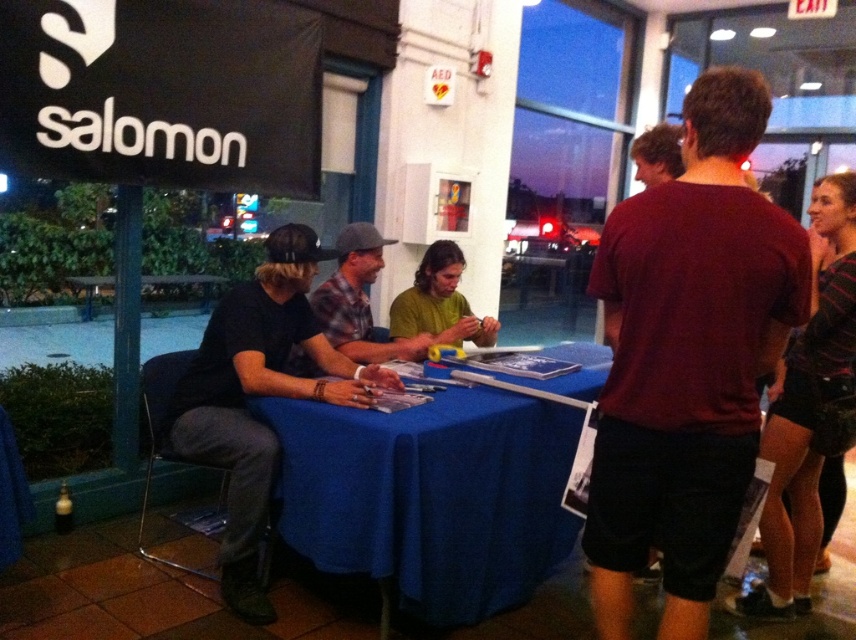
Is black cotton shirt at center closer to camera compared to green matte shirt at center?

Yes, it is.

Image resolution: width=856 pixels, height=640 pixels. I want to click on black cotton shirt at center, so click(x=259, y=396).

Which is more to the right, black cotton shirt at center or green matte shirt at upper center?

Positioned to the right is green matte shirt at upper center.

Does black cotton shirt at center have a greater width compared to green matte shirt at upper center?

Correct, the width of black cotton shirt at center exceeds that of green matte shirt at upper center.

Describe the element at coordinates (259, 396) in the screenshot. I see `black cotton shirt at center` at that location.

Find the location of `black cotton shirt at center`. black cotton shirt at center is located at coordinates [259, 396].

Can you confirm if blue fabric table at center is positioned above green matte shirt at upper center?

No.

Is blue fabric table at center to the right of green matte shirt at upper center from the viewer's perspective?

No, blue fabric table at center is not to the right of green matte shirt at upper center.

Who is more distant from viewer, (x=528, y=458) or (x=657, y=141)?

Positioned behind is point (x=657, y=141).

Image resolution: width=856 pixels, height=640 pixels. What are the coordinates of `blue fabric table at center` in the screenshot? It's located at (431, 496).